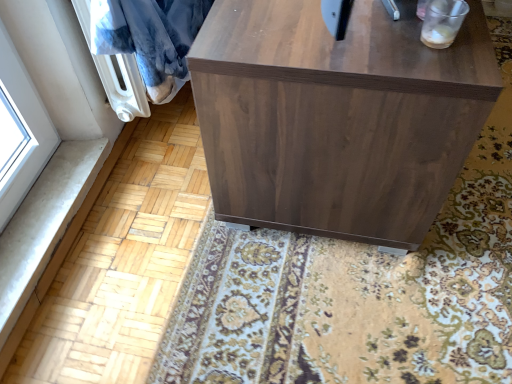
Image resolution: width=512 pixels, height=384 pixels. What do you see at coordinates (150, 37) in the screenshot? I see `blue plush blanket at upper left` at bounding box center [150, 37].

The image size is (512, 384). Find the location of `blue plush blanket at upper left`. blue plush blanket at upper left is located at coordinates [150, 37].

Image resolution: width=512 pixels, height=384 pixels. Identify the location of walnut wood cabinet at center. (337, 117).

This screenshot has height=384, width=512. What do you see at coordinates (337, 117) in the screenshot? I see `walnut wood cabinet at center` at bounding box center [337, 117].

Where is `blue plush blanket at upper left`? This screenshot has width=512, height=384. blue plush blanket at upper left is located at coordinates (150, 37).

Is walnut wood cabinet at center at the right side of blue plush blanket at upper left?

Yes.

Considering the relative positions of walnut wood cabinet at center and blue plush blanket at upper left in the image provided, is walnut wood cabinet at center in front of blue plush blanket at upper left?

Yes, walnut wood cabinet at center is closer to the camera.

Which is nearer, (x=237, y=152) or (x=184, y=29)?

Point (x=237, y=152)

From the image's perspective, is walnut wood cabinet at center located above or below blue plush blanket at upper left?

From the image's perspective, walnut wood cabinet at center appears above blue plush blanket at upper left.

From a real-world perspective, who is located higher, walnut wood cabinet at center or blue plush blanket at upper left?

In real-world perspective, blue plush blanket at upper left is above.

Between walnut wood cabinet at center and blue plush blanket at upper left, which one has larger width?

With larger width is walnut wood cabinet at center.

Can you confirm if walnut wood cabinet at center is taller than blue plush blanket at upper left?

Yes, walnut wood cabinet at center is taller than blue plush blanket at upper left.

Considering the relative sizes of walnut wood cabinet at center and blue plush blanket at upper left in the image provided, is walnut wood cabinet at center smaller than blue plush blanket at upper left?

No.

Is walnut wood cabinet at center outside of blue plush blanket at upper left?

Yes, walnut wood cabinet at center is outside of blue plush blanket at upper left.

Are walnut wood cabinet at center and blue plush blanket at upper left far apart?

No, walnut wood cabinet at center is in close proximity to blue plush blanket at upper left.

Is walnut wood cabinet at center positioned with its back to blue plush blanket at upper left?

Yes, walnut wood cabinet at center's orientation is away from blue plush blanket at upper left.

Measure the distance between walnut wood cabinet at center and blue plush blanket at upper left.

walnut wood cabinet at center and blue plush blanket at upper left are 21.84 inches apart.

This screenshot has width=512, height=384. In order to click on furniture on the right of blue plush blanket at upper left in this screenshot , I will do coord(337,117).

Considering the positions of objects blue plush blanket at upper left and walnut wood cabinet at center in the image provided, who is more to the left, blue plush blanket at upper left or walnut wood cabinet at center?

blue plush blanket at upper left.

Considering the positions of objects blue plush blanket at upper left and walnut wood cabinet at center in the image provided, who is in front, blue plush blanket at upper left or walnut wood cabinet at center?

walnut wood cabinet at center.

Which point is more distant from viewer, (178, 18) or (352, 153)?

The point (178, 18) is farther.

From the image's perspective, is blue plush blanket at upper left above or below walnut wood cabinet at center?

From the image's perspective, blue plush blanket at upper left appears below walnut wood cabinet at center.

From a real-world perspective, does blue plush blanket at upper left stand above walnut wood cabinet at center?

Yes, from a real-world perspective, blue plush blanket at upper left is above walnut wood cabinet at center.

Does blue plush blanket at upper left have a greater width compared to walnut wood cabinet at center?

No.

Is blue plush blanket at upper left shorter than walnut wood cabinet at center?

Yes.

Is blue plush blanket at upper left bigger or smaller than walnut wood cabinet at center?

blue plush blanket at upper left is smaller than walnut wood cabinet at center.

Would you say blue plush blanket at upper left contains walnut wood cabinet at center?

Actually, walnut wood cabinet at center is outside blue plush blanket at upper left.

Would you say blue plush blanket at upper left is a long distance from walnut wood cabinet at center?

They are positioned close to each other.

Is blue plush blanket at upper left facing towards walnut wood cabinet at center?

Yes.

Based on the photo, how different are the orientations of blue plush blanket at upper left and walnut wood cabinet at center in degrees?

They differ by 0.0853 degrees in their facing directions.

Measure the distance between blue plush blanket at upper left and walnut wood cabinet at center.

They are 21.84 inches apart.

The width and height of the screenshot is (512, 384). I want to click on blanket on the left of walnut wood cabinet at center, so click(150, 37).

The image size is (512, 384). Identify the location of furniture that is on the right side of blue plush blanket at upper left. (337, 117).

Identify the location of furniture in front of the blue plush blanket at upper left. (337, 117).